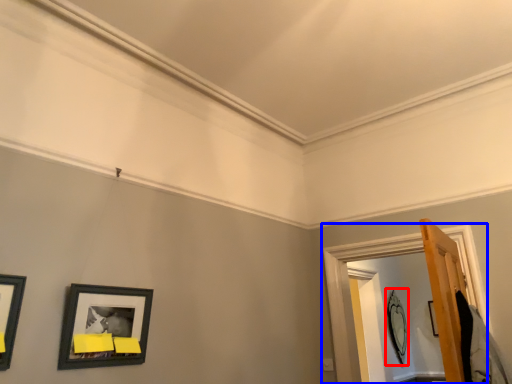
Question: Which object is further to the camera taking this photo, picture frame (highlighted by a red box) or window frame (highlighted by a blue box)?

Choices:
 (A) picture frame
 (B) window frame

Answer: (A)